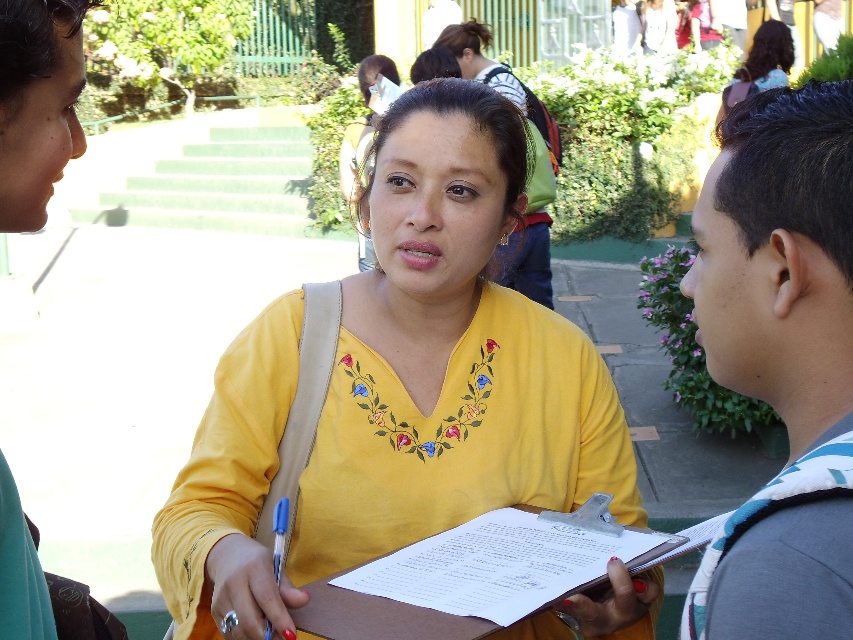
Which is behind, point (457, 340) or point (506, 576)?

Point (457, 340)

Describe the element at coordinates (398, 387) in the screenshot. I see `yellow embroidered shirt at center` at that location.

Is point (444, 316) more distant than point (408, 636)?

Yes.

Identify the location of yellow embroidered shirt at center. The image size is (853, 640). (398, 387).

Does yellow embroidered shirt at center have a greater width compared to curly hair at upper right?

Indeed, yellow embroidered shirt at center has a greater width compared to curly hair at upper right.

Consider the image. Is yellow embroidered shirt at center taller than curly hair at upper right?

Indeed, yellow embroidered shirt at center has a greater height compared to curly hair at upper right.

Is point (463, 481) closer to camera compared to point (769, 61)?

That is True.

You are a GUI agent. You are given a task and a screenshot of the screen. Output one action in this format:
    pyautogui.click(x=<x>, y=<y>)
    Task: Click on the yellow embroidered shirt at center
    This screenshot has height=640, width=853.
    Given the screenshot: What is the action you would take?
    pyautogui.click(x=398, y=387)

Is gray fabric backpack at right above brown cardboard clipboard at center?

Yes, gray fabric backpack at right is above brown cardboard clipboard at center.

Where is `gray fabric backpack at right`? The image size is (853, 640). gray fabric backpack at right is located at coordinates (781, 358).